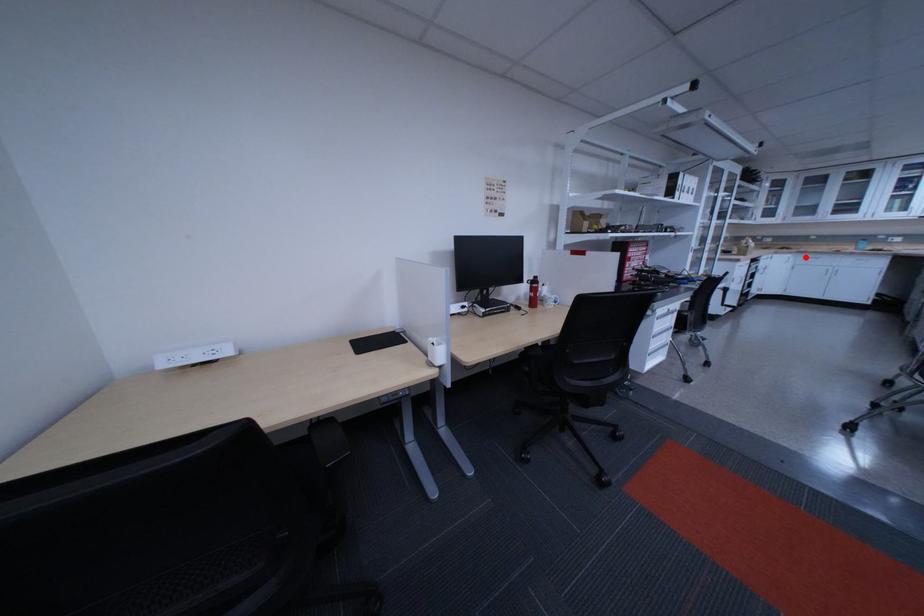
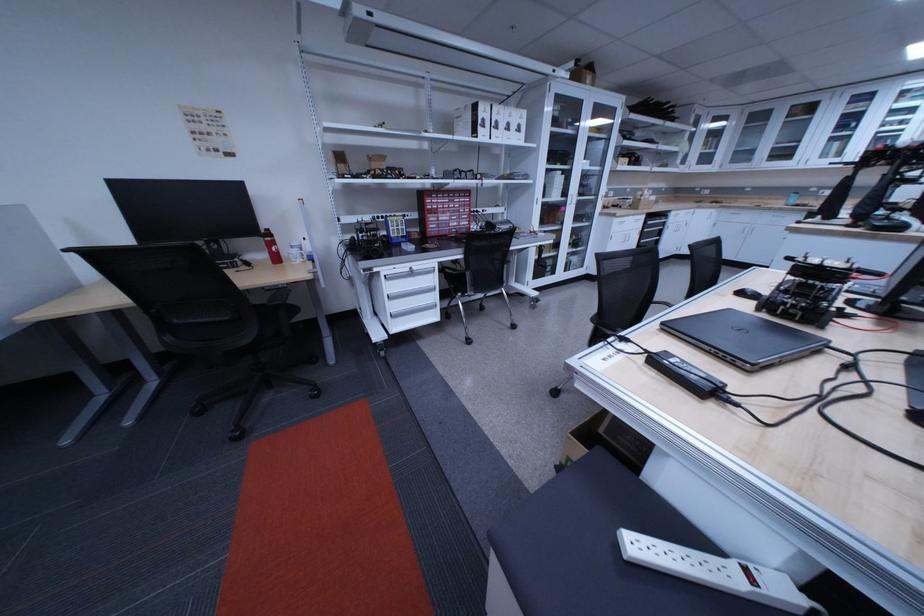
Locate, in the second image, the point that corresponds to the highlighted location in the first image.

(728, 212)